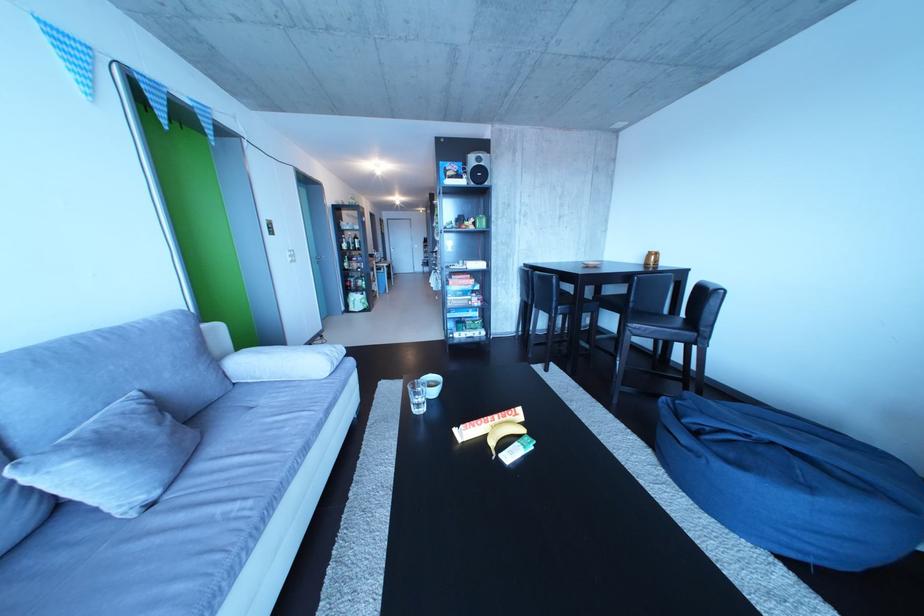
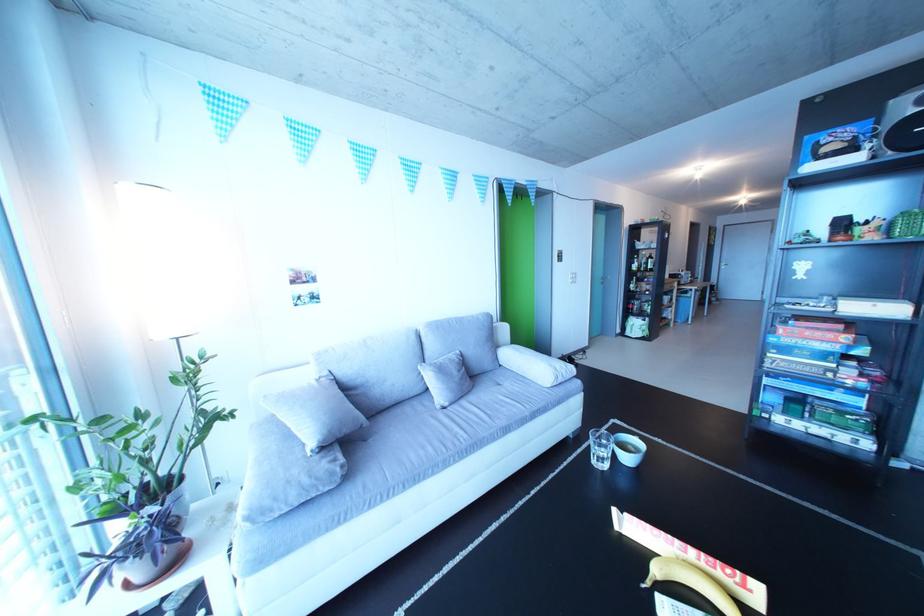
In the second image, find the point that corresponds to (242,379) in the first image.

(513, 363)